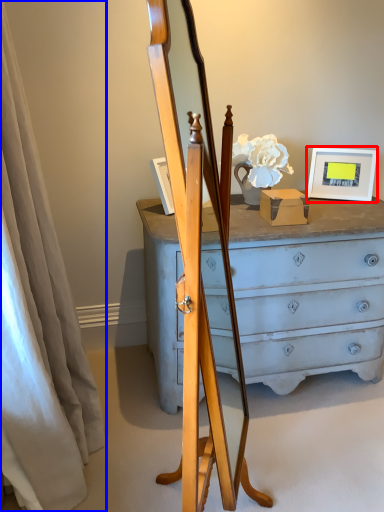
Question: Among these objects, which one is nearest to the camera, picture frame (highlighted by a red box) or curtain (highlighted by a blue box)?

Choices:
 (A) picture frame
 (B) curtain

Answer: (B)